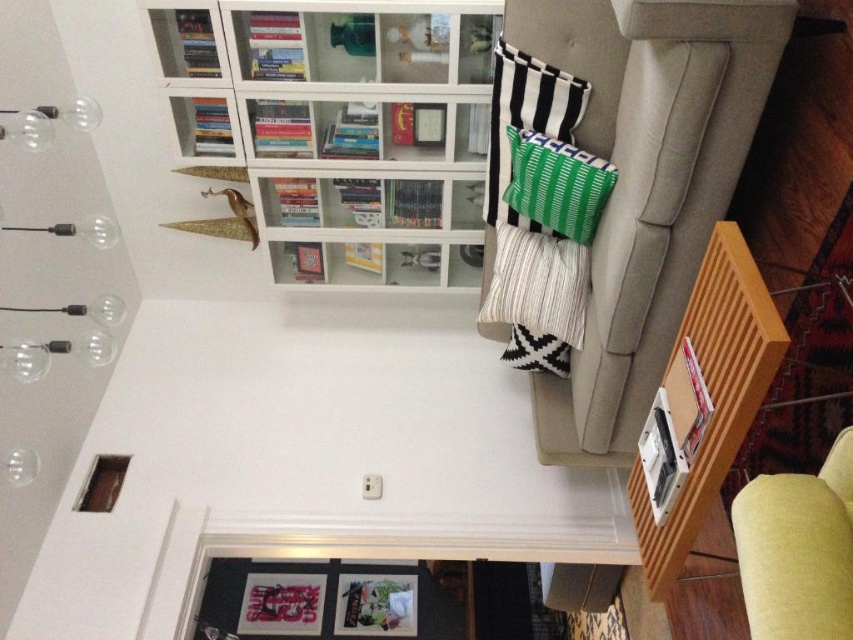
You are sitting on the light yellow fabric armchair at lower right and want to place a book on the white glass bookshelf at upper left. Can you reach it without getting up?

The white glass bookshelf at upper left is above the light yellow fabric armchair at lower right, so you can reach it without getting up.

You are arranging a new lamp on the light yellow fabric armchair at lower right and want to place it closer to the white glass bookshelf at upper left. Based on their positions, which direction should you move the lamp towards?

The white glass bookshelf at upper left is positioned on the left side of the light yellow fabric armchair at lower right, so you should move the lamp towards the left to place it closer to the white glass bookshelf at upper left.